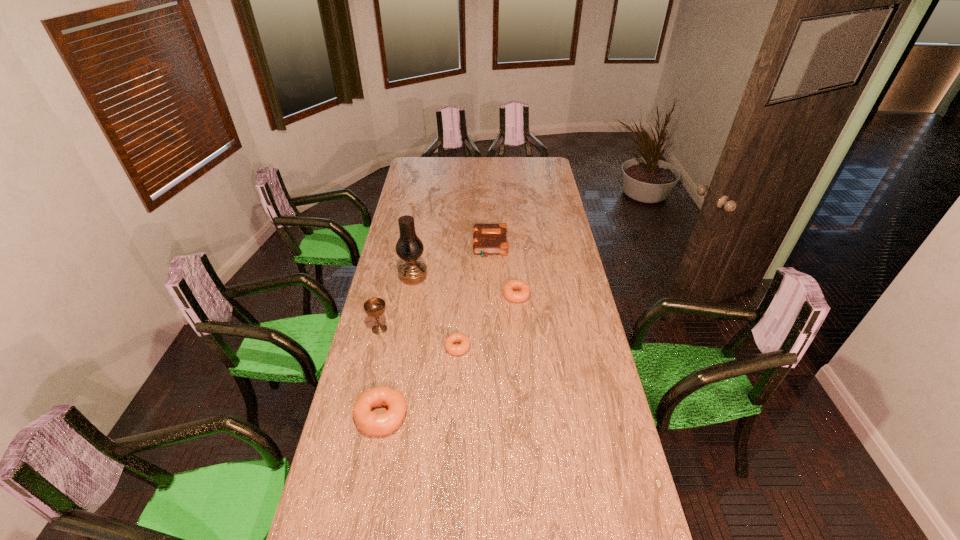
Find the location of a particular element. free space located 0.160m on the back of the nearest doughnut is located at coordinates (393, 357).

Find the location of a particular element. blank area located on the back of the fifth farthest object is located at coordinates (459, 313).

In order to click on vacant space located 0.290m on the back of the second shortest doughnut in this screenshot , I will do `click(512, 246)`.

You are a GUI agent. You are given a task and a screenshot of the screen. Output one action in this format:
    pyautogui.click(x=<x>, y=<y>)
    Task: Click on the free location located on the spine side of the farthest object
    This screenshot has width=960, height=540.
    Given the screenshot: What is the action you would take?
    pyautogui.click(x=437, y=245)

Where is `free space located 0.360m on the spine side of the farthest object`? free space located 0.360m on the spine side of the farthest object is located at coordinates (400, 245).

Identify the location of free location located on the spine side of the farthest object. (415, 245).

This screenshot has width=960, height=540. Identify the location of free point located on the back of the chalice. (386, 300).

Image resolution: width=960 pixels, height=540 pixels. Identify the location of free region located 0.080m on the left of the tallest object. click(382, 278).

I want to click on doughnut located at the left edge, so click(x=367, y=421).

I want to click on chalice that is at the left edge, so click(374, 307).